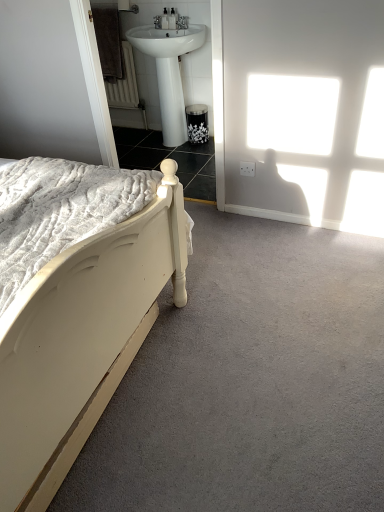
In order to face black metal towel bar at upper center, should I rotate leftwards or rightwards?

Rotate left and turn 10.758 degrees.

Measure the distance between point (83,165) and camera.

The depth of point (83,165) is 1.62 meters.

The image size is (384, 512). Find the location of `black metal towel bar at upper center`. black metal towel bar at upper center is located at coordinates (116, 5).

Who is more distant, black metal towel bar at upper center or white glossy sink at upper center?

black metal towel bar at upper center is further away from the camera.

Identify the location of sink below the black metal towel bar at upper center (from a real-world perspective). The height and width of the screenshot is (512, 384). (171, 62).

Is black metal towel bar at upper center far away from white glossy sink at upper center?

No, there isn't a large distance between black metal towel bar at upper center and white glossy sink at upper center.

From the picture: From the image's perspective, which is above, black metal towel bar at upper center or white painted wood bed at left?

black metal towel bar at upper center, from the image's perspective.

How distant is black metal towel bar at upper center from white painted wood bed at left?

black metal towel bar at upper center and white painted wood bed at left are 2.60 meters apart from each other.

Is black metal towel bar at upper center positioned with its back to white painted wood bed at left?

No, white painted wood bed at left is not at the back of black metal towel bar at upper center.

How different are the orientations of black metal towel bar at upper center and white painted wood bed at left in degrees?

There is a 88.7-degree angle between the facing directions of black metal towel bar at upper center and white painted wood bed at left.

From the image's perspective, is white glossy sink at upper center above or below white painted wood bed at left?

white glossy sink at upper center is situated higher than white painted wood bed at left in the image.

Image resolution: width=384 pixels, height=512 pixels. I want to click on sink below the white painted wood bed at left (from a real-world perspective), so click(x=171, y=62).

Visually, is white glossy sink at upper center positioned to the left or to the right of white painted wood bed at left?

In the image, white glossy sink at upper center appears on the right side of white painted wood bed at left.

How different are the orientations of white glossy sink at upper center and white painted wood bed at left in degrees?

white glossy sink at upper center and white painted wood bed at left are facing 88.6 degrees away from each other.

From the picture: Would you consider white painted wood bed at left to be distant from white glossy sink at upper center?

white painted wood bed at left is far away from white glossy sink at upper center.

In order to click on sink behind the white painted wood bed at left in this screenshot , I will do [171, 62].

From the image's perspective, is white painted wood bed at left positioned above or below white glossy sink at upper center?

white painted wood bed at left is below white glossy sink at upper center.

Which of these two, white painted wood bed at left or white glossy sink at upper center, stands taller?

white painted wood bed at left.

Can you tell me how much white painted wood bed at left and black metal towel bar at upper center differ in facing direction?

There is a 88.7-degree angle between the facing directions of white painted wood bed at left and black metal towel bar at upper center.

Which is closer, [101,254] or [98,1]?

The point [101,254] is closer.

Is black metal towel bar at upper center completely or partially inside white painted wood bed at left?

That's incorrect, black metal towel bar at upper center is not inside white painted wood bed at left.

Is white painted wood bed at left shorter than black metal towel bar at upper center?

No, white painted wood bed at left is not shorter than black metal towel bar at upper center.

Choose the correct answer: Is white glossy sink at upper center inside black metal towel bar at upper center or outside it?

white glossy sink at upper center exists outside the volume of black metal towel bar at upper center.

From a real-world perspective, is white glossy sink at upper center physically below black metal towel bar at upper center?

Yes, from a real-world perspective, white glossy sink at upper center is beneath black metal towel bar at upper center.

Is white glossy sink at upper center facing away from black metal towel bar at upper center?

No, white glossy sink at upper center's orientation is not away from black metal towel bar at upper center.

From the image's perspective, which object appears higher, white glossy sink at upper center or black metal towel bar at upper center?

black metal towel bar at upper center is shown above in the image.

Identify the location of towel bar that appears above the white glossy sink at upper center (from a real-world perspective). (116, 5).

This screenshot has width=384, height=512. In order to click on bed below the black metal towel bar at upper center (from a real-world perspective) in this screenshot , I will do `click(75, 304)`.

Which object lies nearer to the anchor point white painted wood bed at left, black metal towel bar at upper center or white glossy sink at upper center?

The object closer to white painted wood bed at left is white glossy sink at upper center.

From the image, which object appears to be nearer to black metal towel bar at upper center, white painted wood bed at left or white glossy sink at upper center?

Among the two, white glossy sink at upper center is located nearer to black metal towel bar at upper center.

Based on their spatial positions, is black metal towel bar at upper center or white painted wood bed at left closer to white glossy sink at upper center?

black metal towel bar at upper center is positioned closer to the anchor white glossy sink at upper center.

From the picture: Based on their spatial positions, is white painted wood bed at left or black metal towel bar at upper center closer to white glossy sink at upper center?

Based on the image, black metal towel bar at upper center appears to be nearer to white glossy sink at upper center.

Estimate the real-world distances between objects in this image. Which object is further from white painted wood bed at left, white glossy sink at upper center or black metal towel bar at upper center?

black metal towel bar at upper center is further to white painted wood bed at left.

Looking at the image, which one is located closer to black metal towel bar at upper center, white glossy sink at upper center or white painted wood bed at left?

white glossy sink at upper center.

This screenshot has height=512, width=384. Find the location of `sink between white painted wood bed at left and black metal towel bar at upper center from front to back`. sink between white painted wood bed at left and black metal towel bar at upper center from front to back is located at coordinates (171, 62).